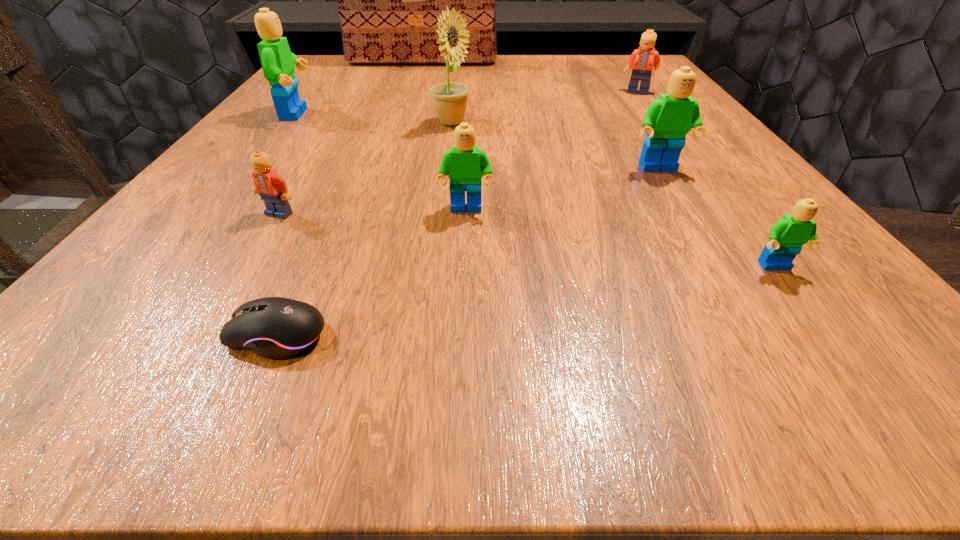
You are a GUI agent. You are given a task and a screenshot of the screen. Output one action in this format:
    pyautogui.click(x=<x>, y=<y>)
    Task: Click on the green Lego object that ranks as the third closest to the third smallest green Lego
    Image resolution: width=960 pixels, height=540 pixels.
    Given the screenshot: What is the action you would take?
    pyautogui.click(x=278, y=62)

Select which green Lego is the closest to the nearest object. Please provide its 2D coordinates. Your answer should be formatted as a tuple, i.e. [(x, y)], where the tuple contains the x and y coordinates of a point satisfying the conditions above.

[(466, 165)]

Find the location of a particular element. The image size is (960, 540). vacant space that satisfies the following two spatial constraints: 1. on the front-facing side of the second farthest object; 2. on the face of the sunflower is located at coordinates (660, 123).